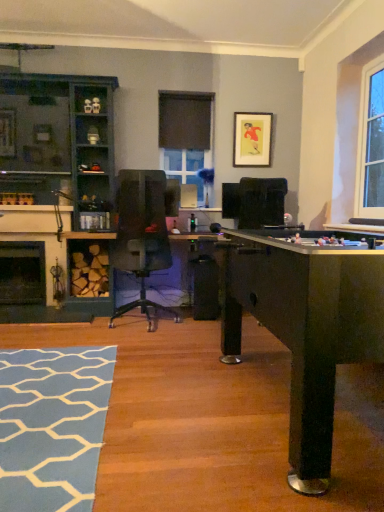
Image resolution: width=384 pixels, height=512 pixels. I want to click on free point below blue textured rug at lower left (from a real-world perspective), so click(44, 409).